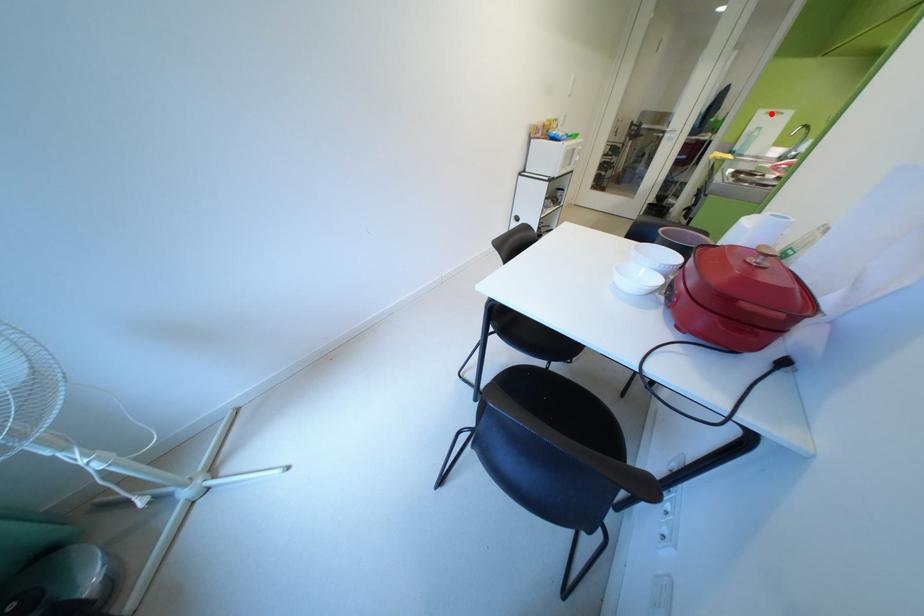
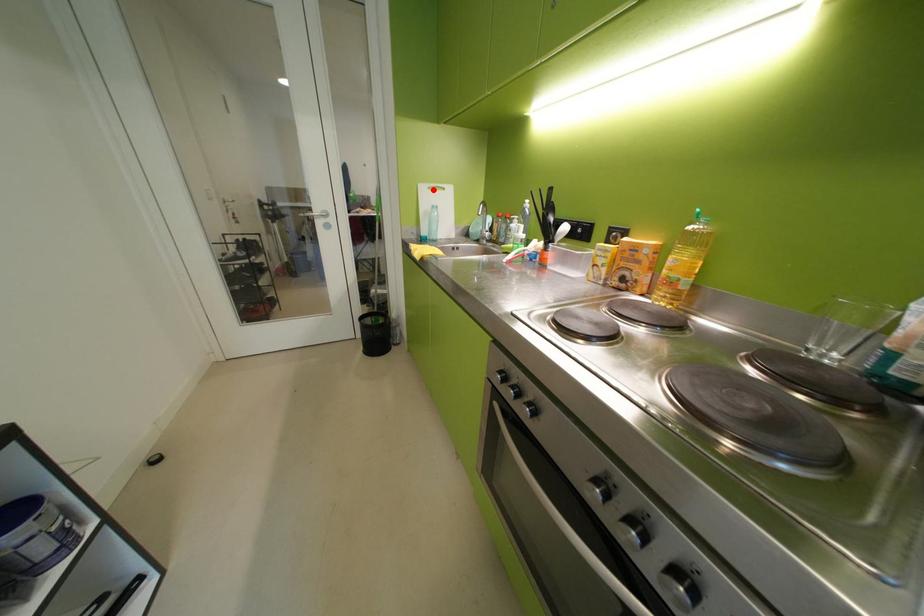
From the picture: I am providing you with two images of the same scene from different viewpoints. A red point is marked on the first image and another point is marked on the second image. Are the points marked in image1 and image2 representing the same 3D position?

Yes